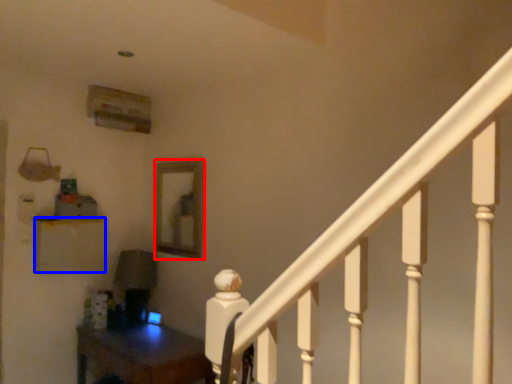
Question: Which object is closer to the camera taking this photo, mirror (highlighted by a red box) or furniture (highlighted by a blue box)?

Choices:
 (A) mirror
 (B) furniture

Answer: (B)